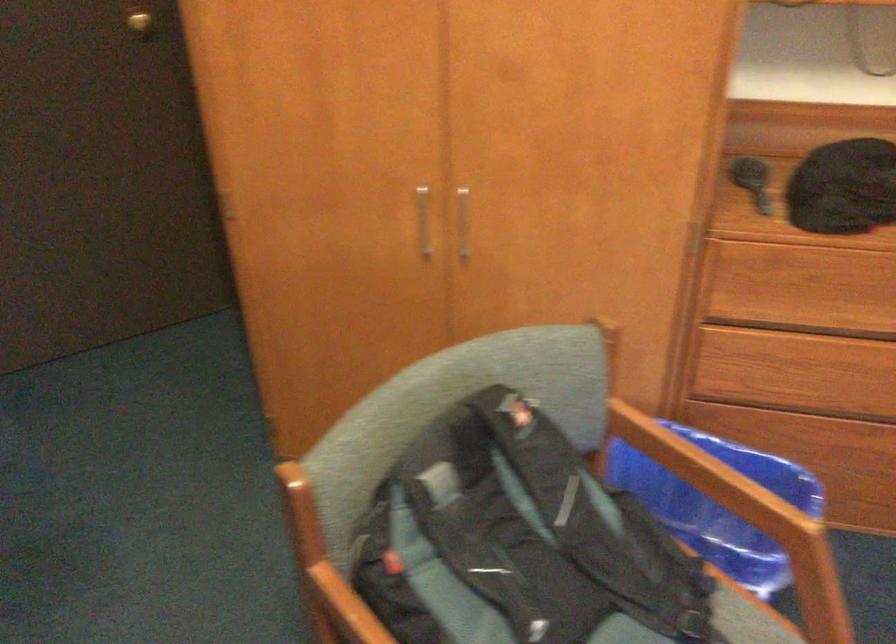
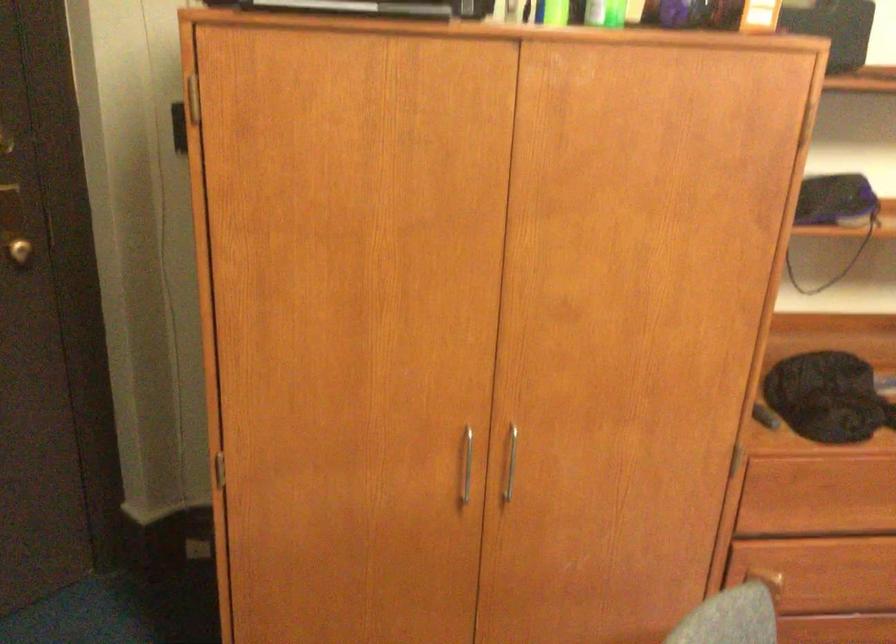
In the second image, find the point that corresponds to [811,287] in the first image.

(825, 495)